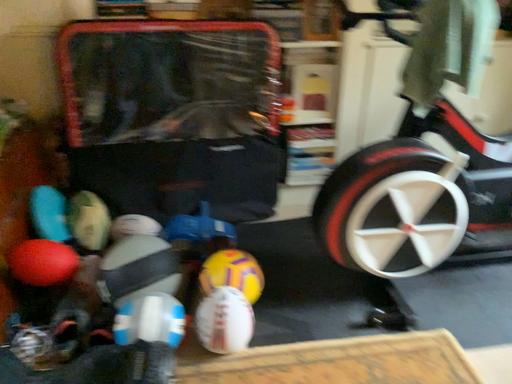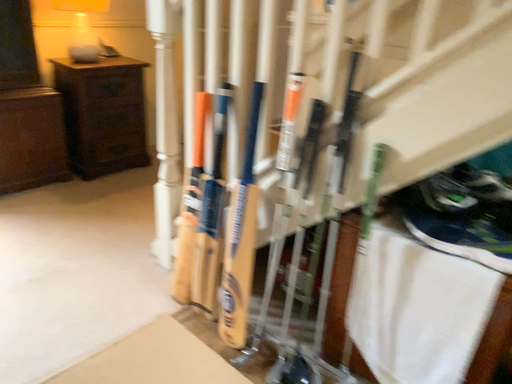
Question: Which way did the camera rotate in the video?

Choices:
 (A) rotated right
 (B) rotated left

Answer: (B)